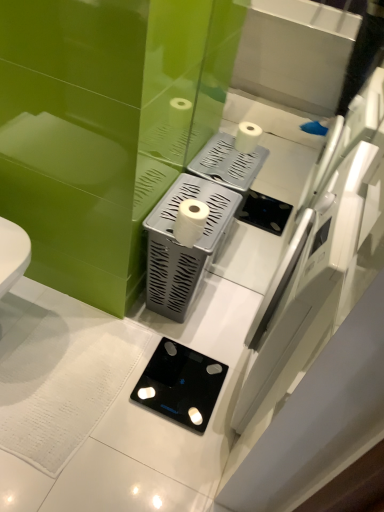
The image size is (384, 512). I want to click on vacant space in front of silver textured tissue holder at center, so click(x=167, y=350).